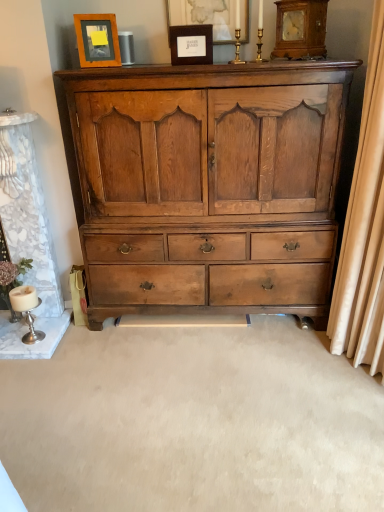
Where is `wooden picture frame at upper center, which ranks as the third picture frame in left-to-right order`? wooden picture frame at upper center, which ranks as the third picture frame in left-to-right order is located at coordinates (205, 16).

What do you see at coordinates (205, 16) in the screenshot? The width and height of the screenshot is (384, 512). I see `wooden picture frame at upper center, which is counted as the 1th picture frame, starting from the right` at bounding box center [205, 16].

What do you see at coordinates (27, 310) in the screenshot? The image size is (384, 512). I see `silver metallic candlestick at lower left` at bounding box center [27, 310].

Find the location of a particular element. silver metallic candlestick at lower left is located at coordinates (27, 310).

The height and width of the screenshot is (512, 384). Describe the element at coordinates (364, 229) in the screenshot. I see `beige fabric curtain at right` at that location.

What do you see at coordinates (191, 44) in the screenshot? The width and height of the screenshot is (384, 512). I see `matte black picture frame at upper center, placed as the 2th picture frame when sorted from left to right` at bounding box center [191, 44].

What are the coordinates of `matte black picture frame at upper center, placed as the 2th picture frame when sorted from left to right` in the screenshot? It's located at (191, 44).

Locate an element on the screen. wooden picture frame at upper center, which is counted as the 1th picture frame, starting from the right is located at coordinates tap(205, 16).

Is beige fabric curtain at right turned away from matte black picture frame at upper center, placed as the second picture frame when sorted from right to left?

That's not correct — beige fabric curtain at right is not looking away from matte black picture frame at upper center, placed as the second picture frame when sorted from right to left.

Does beige fabric curtain at right touch matte black picture frame at upper center, placed as the 2th picture frame when sorted from left to right?

No.

Considering the relative sizes of beige fabric curtain at right and matte black picture frame at upper center, placed as the second picture frame when sorted from right to left, in the image provided, is beige fabric curtain at right taller than matte black picture frame at upper center, placed as the second picture frame when sorted from right to left,?

Indeed, beige fabric curtain at right has a greater height compared to matte black picture frame at upper center, placed as the second picture frame when sorted from right to left.

Considering the relative sizes of beige fabric curtain at right and matte black picture frame at upper center, placed as the second picture frame when sorted from right to left, in the image provided, is beige fabric curtain at right thinner than matte black picture frame at upper center, placed as the second picture frame when sorted from right to left,?

Incorrect, the width of beige fabric curtain at right is not less than that of matte black picture frame at upper center, placed as the second picture frame when sorted from right to left.

Can you confirm if matte brown wooden chest of drawers at center is wider than wooden clock at upper right?

Yes, matte brown wooden chest of drawers at center is wider than wooden clock at upper right.

Is matte brown wooden chest of drawers at center in front of wooden clock at upper right?

Yes, matte brown wooden chest of drawers at center is in front of wooden clock at upper right.

From the image's perspective, relative to wooden clock at upper right, is matte brown wooden chest of drawers at center above or below?

matte brown wooden chest of drawers at center is situated lower than wooden clock at upper right in the image.

From the image's perspective, is wooden clock at upper right on top of matte brown wooden chest of drawers at center?

Yes.

Looking at this image, does wooden clock at upper right appear on the left side of matte brown wooden chest of drawers at center?

Incorrect, wooden clock at upper right is not on the left side of matte brown wooden chest of drawers at center.

In the scene shown: Who is more distant, wooden clock at upper right or matte brown wooden chest of drawers at center?

wooden clock at upper right is behind.

Which of these two, wooden clock at upper right or matte brown wooden chest of drawers at center, is wider?

Wider between the two is matte brown wooden chest of drawers at center.

Considering the positions of points (243, 34) and (302, 252), is point (243, 34) closer to camera compared to point (302, 252)?

No, it is not.

Are wooden picture frame at upper center, which ranks as the third picture frame in left-to-right order, and matte brown wooden chest of drawers at center located far from each other?

wooden picture frame at upper center, which ranks as the third picture frame in left-to-right order, is actually quite close to matte brown wooden chest of drawers at center.

Is wooden picture frame at upper center, which ranks as the third picture frame in left-to-right order, turned away from matte brown wooden chest of drawers at center?

No, wooden picture frame at upper center, which ranks as the third picture frame in left-to-right order, is not facing the opposite direction of matte brown wooden chest of drawers at center.

Could you measure the distance between wooden clock at upper right and wooden picture frame at upper center, which is counted as the 1th picture frame, starting from the right?

wooden clock at upper right is 13.99 inches from wooden picture frame at upper center, which is counted as the 1th picture frame, starting from the right.

Is wooden clock at upper right facing away from wooden picture frame at upper center, which is counted as the 1th picture frame, starting from the right?

No.

Considering the sizes of wooden clock at upper right and wooden picture frame at upper center, which is counted as the 1th picture frame, starting from the right, in the image, is wooden clock at upper right taller or shorter than wooden picture frame at upper center, which is counted as the 1th picture frame, starting from the right,?

In the image, wooden clock at upper right appears to be taller than wooden picture frame at upper center, which is counted as the 1th picture frame, starting from the right.

Between wooden clock at upper right and wooden picture frame at upper center, which ranks as the third picture frame in left-to-right order, which one has larger size?

wooden clock at upper right.

Considering the positions of point (247, 36) and point (201, 50), is point (247, 36) closer or farther from the camera than point (201, 50)?

Point (247, 36) appears to be farther away from the viewer than point (201, 50).

Between wooden picture frame at upper center, which is counted as the 1th picture frame, starting from the right, and matte black picture frame at upper center, placed as the second picture frame when sorted from right to left, which one appears on the left side from the viewer's perspective?

matte black picture frame at upper center, placed as the second picture frame when sorted from right to left.

Would you consider wooden picture frame at upper center, which is counted as the 1th picture frame, starting from the right, to be distant from matte black picture frame at upper center, placed as the 2th picture frame when sorted from left to right?

No, wooden picture frame at upper center, which is counted as the 1th picture frame, starting from the right, is in close proximity to matte black picture frame at upper center, placed as the 2th picture frame when sorted from left to right.

From a real-world perspective, which object rests below the other?

matte black picture frame at upper center, placed as the second picture frame when sorted from right to left, from a real-world perspective.

In the scene shown: Is beige fabric curtain at right located within wooden clock at upper right?

No, beige fabric curtain at right is located outside of wooden clock at upper right.

Considering the relative sizes of wooden clock at upper right and beige fabric curtain at right in the image provided, is wooden clock at upper right taller than beige fabric curtain at right?

Incorrect, the height of wooden clock at upper right is not larger of that of beige fabric curtain at right.

In terms of width, does wooden clock at upper right look wider or thinner when compared to beige fabric curtain at right?

Clearly, wooden clock at upper right has less width compared to beige fabric curtain at right.

What's the angular difference between wooden clock at upper right and beige fabric curtain at right's facing directions?

There is a 3.17-degree angle between the facing directions of wooden clock at upper right and beige fabric curtain at right.

You are a GUI agent. You are given a task and a screenshot of the screen. Output one action in this format:
    pyautogui.click(x=<x>, y=<y>)
    Task: Click on the curtain on the right of matte black picture frame at upper center, placed as the 2th picture frame when sorted from left to right
    The width and height of the screenshot is (384, 512).
    Given the screenshot: What is the action you would take?
    pyautogui.click(x=364, y=229)

You are a GUI agent. You are given a task and a screenshot of the screen. Output one action in this format:
    pyautogui.click(x=<x>, y=<y>)
    Task: Click on the clock that appears above the matte brown wooden chest of drawers at center (from the image's perspective)
    This screenshot has width=384, height=512.
    Given the screenshot: What is the action you would take?
    pyautogui.click(x=300, y=29)

In the scene shown: When comparing their distances from matte brown wooden chest of drawers at center, does wooden picture frame at upper center, which is counted as the 1th picture frame, starting from the right, or silver metallic candlestick at lower left seem further?

The object further to matte brown wooden chest of drawers at center is silver metallic candlestick at lower left.

When comparing their distances from wooden picture frame at upper center, which is counted as the 1th picture frame, starting from the right, does wooden frame at upper left, the 1th picture frame viewed from the left, or matte black picture frame at upper center, placed as the 2th picture frame when sorted from left to right, seem further?

Among the two, wooden frame at upper left, the 1th picture frame viewed from the left, is located further to wooden picture frame at upper center, which is counted as the 1th picture frame, starting from the right.

Looking at the image, which one is located closer to matte black picture frame at upper center, placed as the second picture frame when sorted from right to left, beige fabric curtain at right or wooden clock at upper right?

wooden clock at upper right.

Considering their positions, is wooden frame at upper left, which is the 3th picture frame from right to left, positioned further to wooden picture frame at upper center, which ranks as the third picture frame in left-to-right order, than matte brown wooden chest of drawers at center?

matte brown wooden chest of drawers at center lies further to wooden picture frame at upper center, which ranks as the third picture frame in left-to-right order, than the other object.

From the image, which object appears to be nearer to wooden frame at upper left, which is the 3th picture frame from right to left, wooden picture frame at upper center, which is counted as the 1th picture frame, starting from the right, or beige fabric curtain at right?

wooden picture frame at upper center, which is counted as the 1th picture frame, starting from the right, lies closer to wooden frame at upper left, which is the 3th picture frame from right to left, than the other object.

Estimate the real-world distances between objects in this image. Which object is further from silver metallic candlestick at lower left, beige fabric curtain at right or matte black picture frame at upper center, placed as the 2th picture frame when sorted from left to right?

beige fabric curtain at right is further to silver metallic candlestick at lower left.

Looking at this image, estimate the real-world distances between objects in this image. Which object is further from wooden clock at upper right, wooden picture frame at upper center, which ranks as the third picture frame in left-to-right order, or matte black picture frame at upper center, placed as the second picture frame when sorted from right to left?

matte black picture frame at upper center, placed as the second picture frame when sorted from right to left, is positioned further to the anchor wooden clock at upper right.

Considering their positions, is silver metallic candlestick at lower left positioned further to matte brown wooden chest of drawers at center than wooden picture frame at upper center, which is counted as the 1th picture frame, starting from the right?

Among the two, silver metallic candlestick at lower left is located further to matte brown wooden chest of drawers at center.

This screenshot has height=512, width=384. In order to click on picture frame between wooden frame at upper left, the 1th picture frame viewed from the left, and wooden picture frame at upper center, which ranks as the third picture frame in left-to-right order, from left to right in this screenshot , I will do `click(191, 44)`.

This screenshot has height=512, width=384. I want to click on clock that lies between wooden picture frame at upper center, which is counted as the 1th picture frame, starting from the right, and matte brown wooden chest of drawers at center from top to bottom, so click(x=300, y=29).

You are a GUI agent. You are given a task and a screenshot of the screen. Output one action in this format:
    pyautogui.click(x=<x>, y=<y>)
    Task: Click on the picture frame between matte black picture frame at upper center, placed as the second picture frame when sorted from right to left, and silver metallic candlestick at lower left vertically
    
    Given the screenshot: What is the action you would take?
    pyautogui.click(x=97, y=40)

I want to click on chest of drawers between silver metallic candlestick at lower left and beige fabric curtain at right, so 206,180.